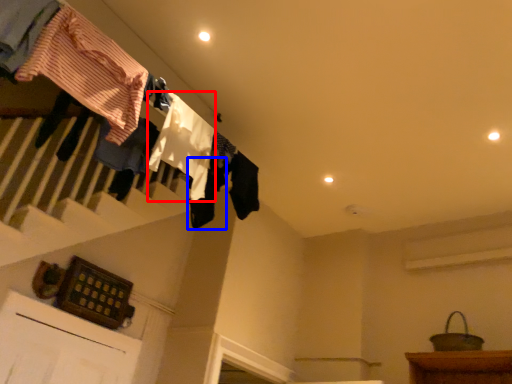
Question: Which point is closer to the camera, clothing (highlighted by a red box) or clothing (highlighted by a blue box)?

Choices:
 (A) clothing
 (B) clothing

Answer: (A)